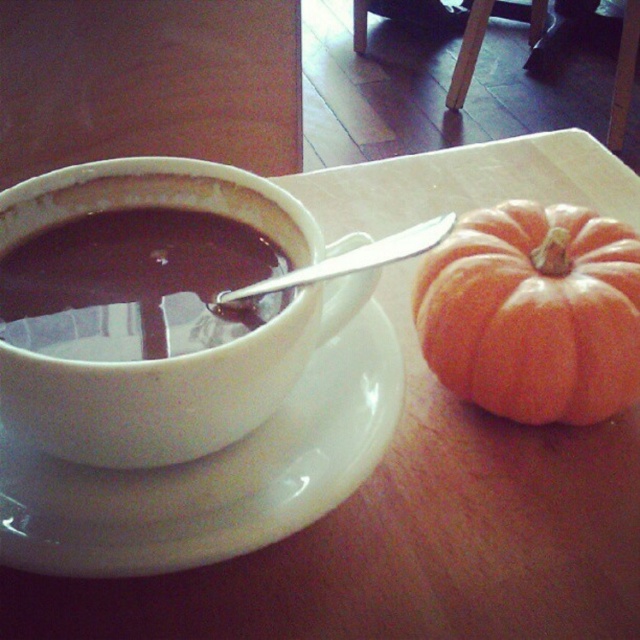
Which is in front, point (52, 333) or point (316, 280)?

Point (316, 280) is more forward.

Is matte ceramic cup at left behind satin silver spoon at upper center?

Yes, it is.

Between point (65, 236) and point (301, 282), which one is positioned behind?

Point (65, 236)

This screenshot has height=640, width=640. What are the coordinates of `matte ceramic cup at left` in the screenshot? It's located at (134, 284).

Does point (164, 572) come closer to viewer compared to point (134, 316)?

That is True.

Which of these two, white glossy saucer at center or matte ceramic cup at left, stands taller?

white glossy saucer at center is taller.

The width and height of the screenshot is (640, 640). Describe the element at coordinates (212, 476) in the screenshot. I see `white glossy saucer at center` at that location.

You are a GUI agent. You are given a task and a screenshot of the screen. Output one action in this format:
    pyautogui.click(x=<x>, y=<y>)
    Task: Click on the white glossy saucer at center
    Image resolution: width=640 pixels, height=640 pixels.
    Given the screenshot: What is the action you would take?
    pyautogui.click(x=212, y=476)

Which is more to the left, orange matte pumpkin at right or satin silver spoon at upper center?

Positioned to the left is satin silver spoon at upper center.

Is point (496, 243) positioned behind point (429, 227)?

Yes, point (496, 243) is farther from viewer.

Find the location of a particular element. The height and width of the screenshot is (640, 640). orange matte pumpkin at right is located at coordinates (532, 312).